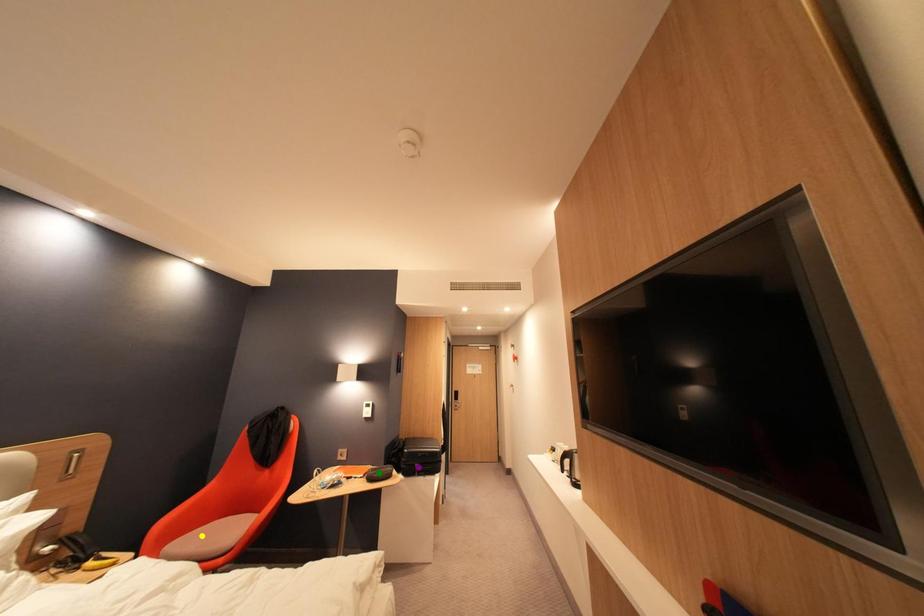
Order these from nearest to farthest:
purple point, yellow point, green point

yellow point, green point, purple point